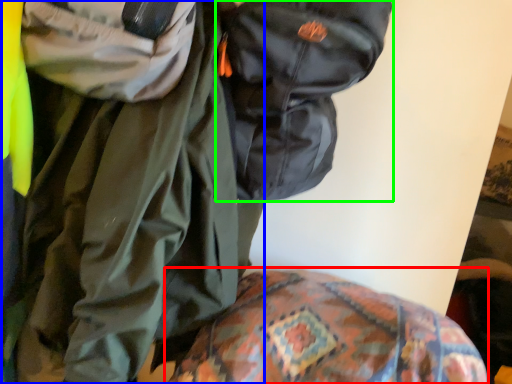
Question: Which is farther away from bedding (highlighted by a red box)? jacket (highlighted by a blue box) or backpack (highlighted by a green box)?

Choices:
 (A) jacket
 (B) backpack

Answer: (B)